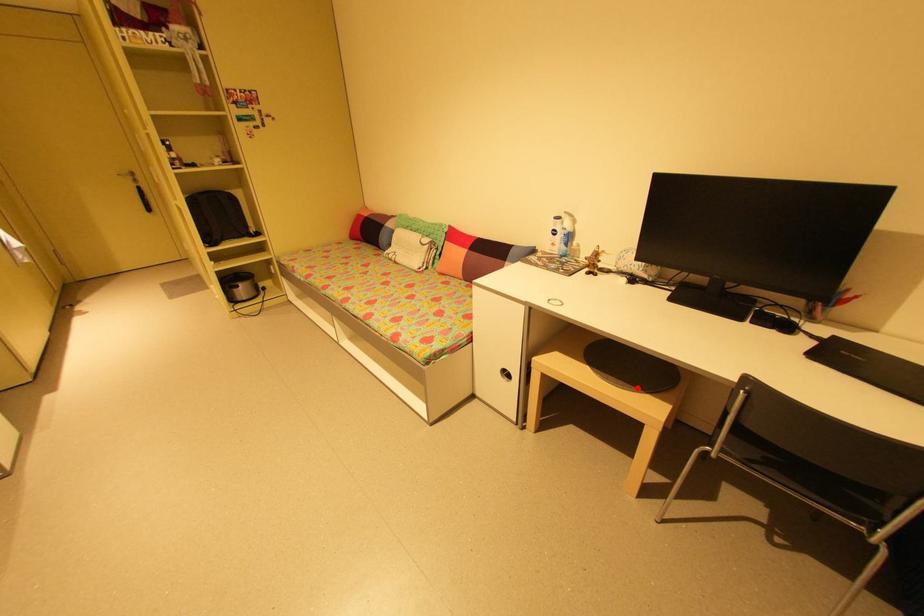
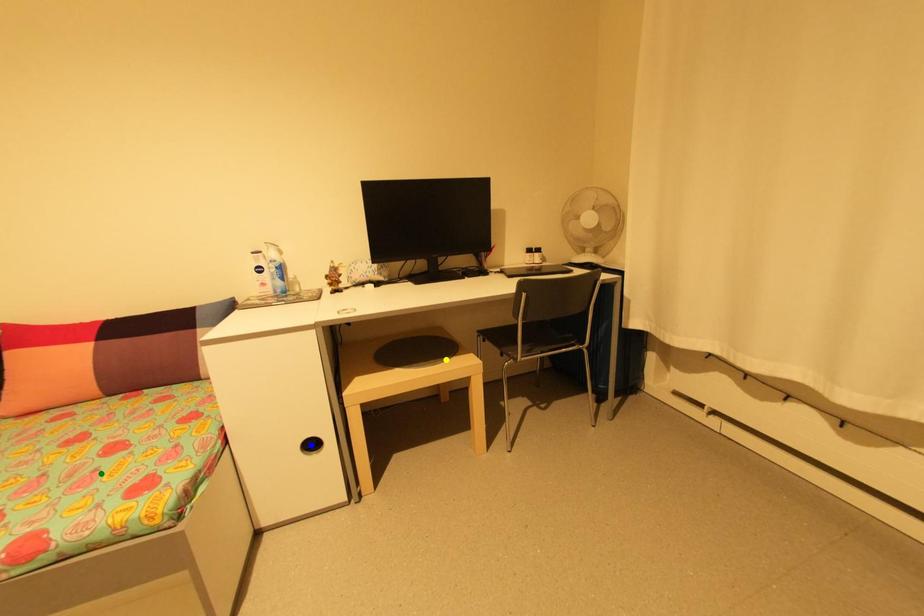
Question: I am providing you with two images of the same scene from different viewpoints. A red point is marked on the first image. You are given multiple points on the second image. Which mark in image 2 goes with the point in image 1?

Choices:
 (A) yellow point
 (B) blue point
 (C) green point

Answer: (A)